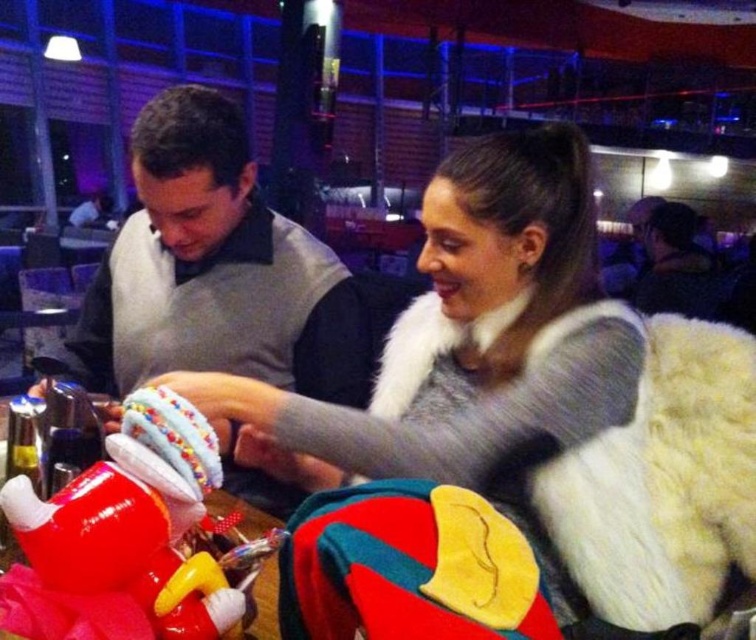
Question: Estimate the real-world distances between objects in this image. Which object is closer to the rubberized plastic toy at lower left?

Choices:
 (A) gray sweater vest at center
 (B) fuzzy gray vest at upper right

Answer: (A)

Question: Estimate the real-world distances between objects in this image. Which object is farther from the rubberized plastic toy at lower left?

Choices:
 (A) gray sweater vest at center
 (B) fuzzy gray vest at upper right

Answer: (B)

Question: Is white fur coat at center to the right of white fur coat at upper center from the viewer's perspective?

Choices:
 (A) no
 (B) yes

Answer: (A)

Question: Is rubberized plastic toy at lower left wider than fuzzy gray vest at upper right?

Choices:
 (A) no
 (B) yes

Answer: (A)

Question: Is white fur coat at center positioned behind fuzzy gray vest at upper right?

Choices:
 (A) no
 (B) yes

Answer: (A)

Question: Based on their relative distances, which object is farther from the white fur coat at upper center?

Choices:
 (A) rubberized plastic toy at lower left
 (B) white fur coat at center

Answer: (A)